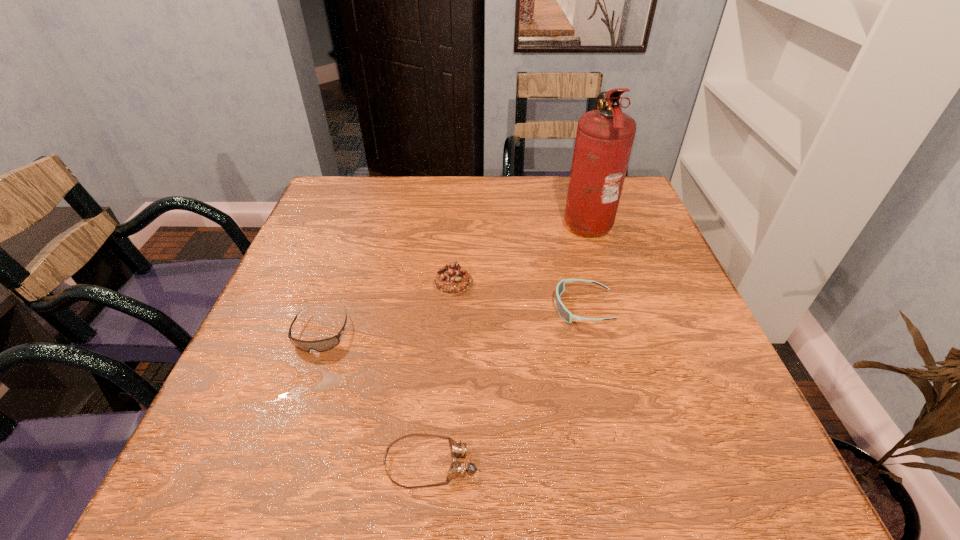
Locate an element on the screen. The image size is (960, 540). the farthest object is located at coordinates (604, 139).

This screenshot has width=960, height=540. Identify the location of the tallest object. (604, 139).

This screenshot has height=540, width=960. Identify the location of chocolate cake. (451, 280).

In order to click on the rightmost goggles in this screenshot , I will do `click(566, 315)`.

This screenshot has width=960, height=540. Find the location of `the leftmost object`. the leftmost object is located at coordinates (326, 344).

I want to click on the second goggles from left to right, so click(458, 449).

The image size is (960, 540). In order to click on the nearest goggles in this screenshot , I will do `click(458, 449)`.

Locate an element on the screen. Image resolution: width=960 pixels, height=540 pixels. free space located at the front of the tallest object where the nozzle is aimed is located at coordinates (454, 221).

Find the location of `vacant space situated 0.150m at the front of the tallest object where the nozzle is aimed`. vacant space situated 0.150m at the front of the tallest object where the nozzle is aimed is located at coordinates (506, 221).

At what (x,y) coordinates should I click in order to perform the action: click on vacant region located 0.090m at the front of the tallest object where the nozzle is aimed. Please return your answer as a coordinate pair (x, y). This screenshot has height=540, width=960. Looking at the image, I should click on (528, 221).